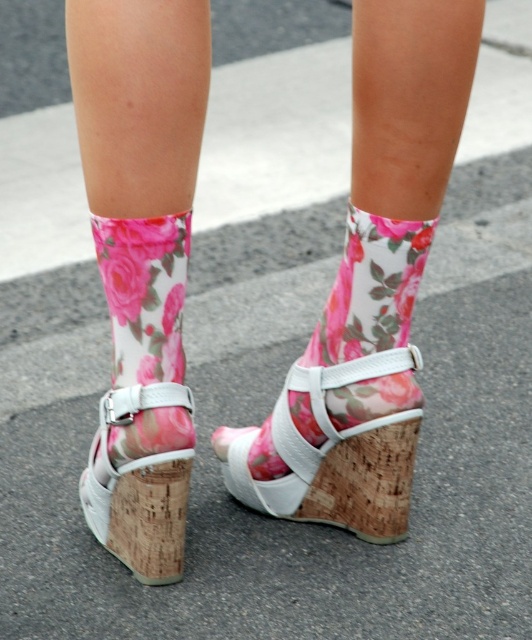
Which of these two, white leather wedge at center or white cork wedge at lower center, stands shorter?

With less height is white cork wedge at lower center.

Does point (410, 435) lie behind point (159, 524)?

Yes, it is.

This screenshot has height=640, width=532. Identify the location of white leather wedge at center. (336, 456).

I want to click on white leather wedge at center, so (x=336, y=456).

Is point (165, 150) in front of point (105, 440)?

Yes, it is in front of point (105, 440).

Which of these two, floral socks at center or floral fabric sock at lower center, stands shorter?

With less height is floral fabric sock at lower center.

Measure the distance between point (130, 500) and camera.

A distance of 4.37 feet exists between point (130, 500) and camera.

Locate an element on the screen. The height and width of the screenshot is (640, 532). floral socks at center is located at coordinates (371, 282).

Between point (113, 376) and point (231, 452), which one is positioned behind?

Point (231, 452)

Looking at this image, can you confirm if floral fabric sock at lower center is thinner than cork heel at center?

No.

Who is more forward, (114, 236) or (252, 440)?

Point (114, 236)

The image size is (532, 640). What are the coordinates of `floral fabric sock at lower center` in the screenshot? It's located at tap(145, 333).